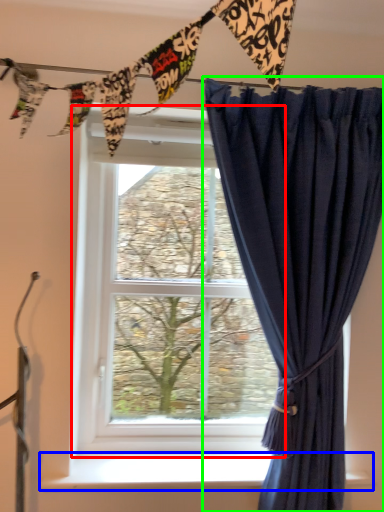
Question: Based on their relative distances, which object is farther from window (highlighted by a red box)? Choose from window sill (highlighted by a blue box) and curtain (highlighted by a green box).

Choices:
 (A) window sill
 (B) curtain

Answer: (A)